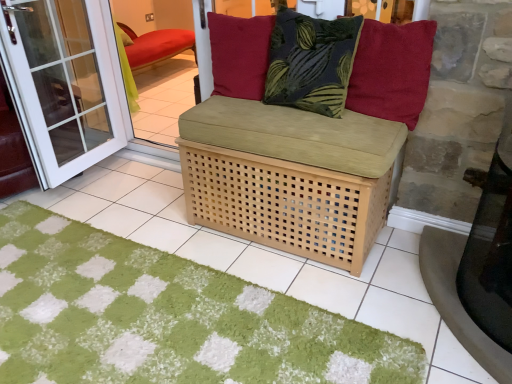
Identify the location of vacant space that is in between white glass screen door at left and natural wood basket at center. (151, 202).